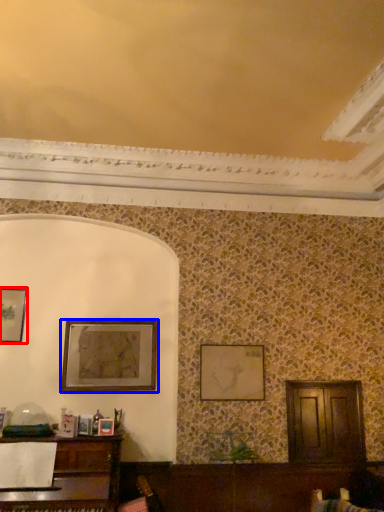
Question: Which object appears closest to the camera in this image, picture frame (highlighted by a red box) or picture frame (highlighted by a blue box)?

Choices:
 (A) picture frame
 (B) picture frame

Answer: (B)